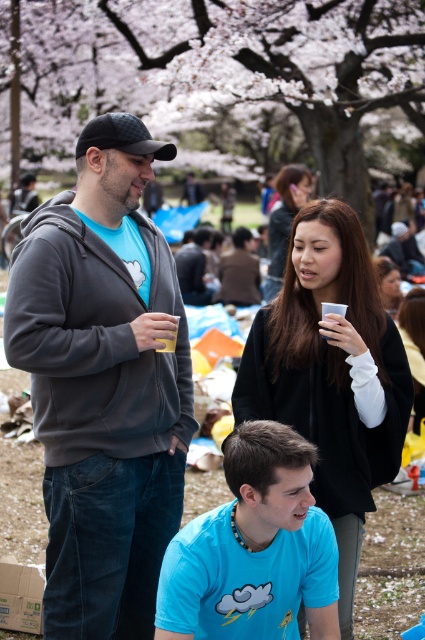
Question: Does dark brown leather jacket at center have a smaller size compared to dark gray hoodie at center?

Choices:
 (A) no
 (B) yes

Answer: (B)

Question: Based on their relative distances, which object is nearer to the blue matte shirt at lower center?

Choices:
 (A) matte black hair at upper center
 (B) matte gray hoodie at center
 (C) dark gray hoodie at center
 (D) dark brown leather jacket at center

Answer: (B)

Question: Among these objects, which one is farthest from the camera?

Choices:
 (A) dark gray hoodie at center
 (B) dark brown leather jacket at center

Answer: (A)

Question: Is black matte sweater at upper center positioned before dark brown leather jacket at center?

Choices:
 (A) yes
 (B) no

Answer: (A)

Question: Which object appears closest to the camera in this image?

Choices:
 (A) dark brown leather jacket at center
 (B) matte black hair at center
 (C) blue matte shirt at lower center
 (D) matte gray hoodie at center

Answer: (C)

Question: Is black matte sweater at upper center wider than matte black hair at center?

Choices:
 (A) no
 (B) yes

Answer: (B)